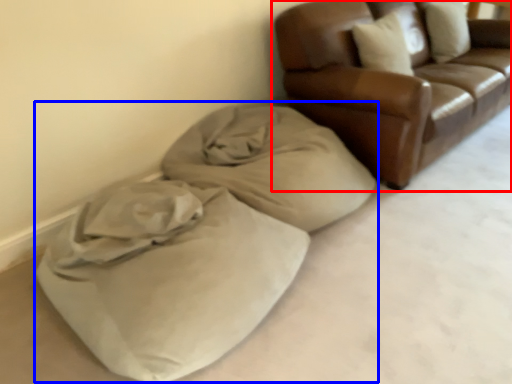
Question: Among these objects, which one is nearest to the camera, studio couch (highlighted by a red box) or bean bag chair (highlighted by a blue box)?

Choices:
 (A) studio couch
 (B) bean bag chair

Answer: (B)